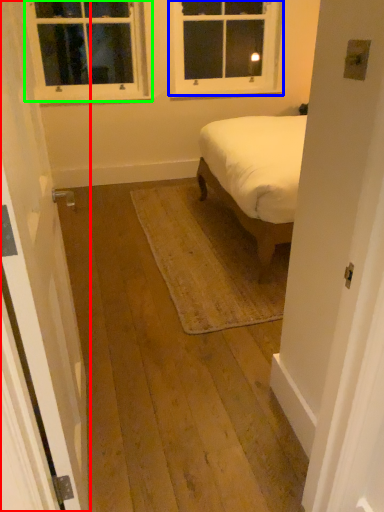
Question: Which object is positioned closest to door (highlighted by a red box)? Select from window (highlighted by a blue box) and window (highlighted by a green box).

Choices:
 (A) window
 (B) window

Answer: (B)